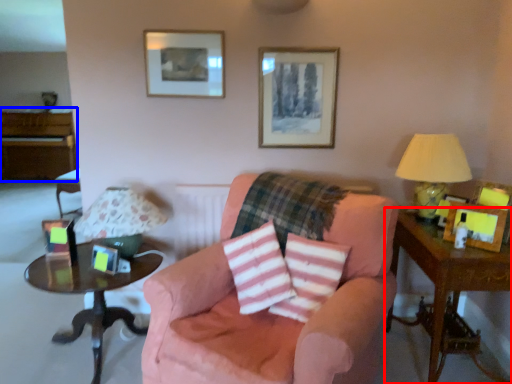
Question: Which object appears closest to the camera in this image, table (highlighted by a red box) or dresser (highlighted by a blue box)?

Choices:
 (A) table
 (B) dresser

Answer: (A)